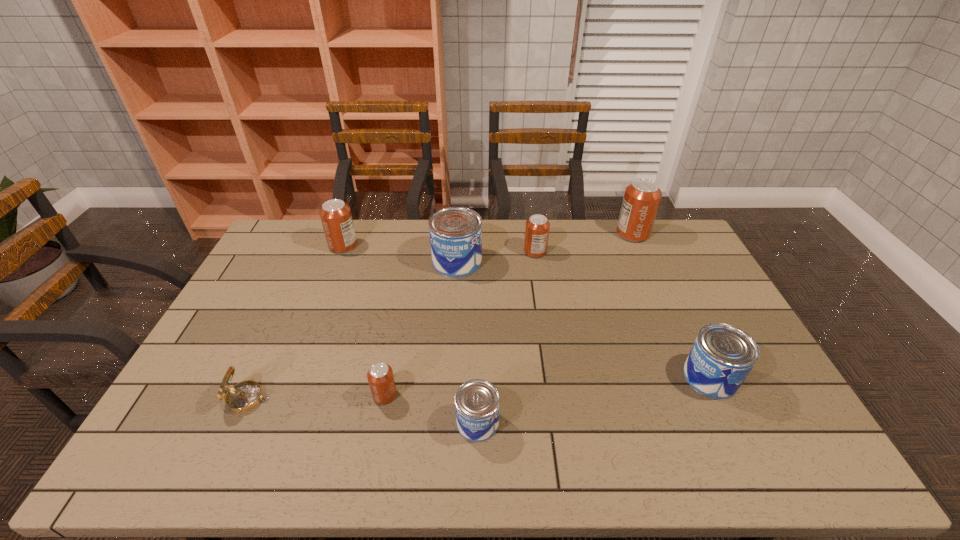
At what (x,y) coordinates should I click in order to perform the action: click on the second can from left to right. Please return your answer as a coordinate pair (x, y). Looking at the image, I should click on (380, 376).

The height and width of the screenshot is (540, 960). I want to click on the smallest orange can, so click(380, 376).

You are a GUI agent. You are given a task and a screenshot of the screen. Output one action in this format:
    pyautogui.click(x=<x>, y=<y>)
    Task: Click on the nearest blue can
    The width and height of the screenshot is (960, 540).
    Given the screenshot: What is the action you would take?
    pyautogui.click(x=477, y=402)

Find the location of a particular element. This screenshot has height=540, width=960. vacant space located 0.070m on the left of the rightmost orange can is located at coordinates tap(598, 234).

Where is `vacant space situated on the front of the leftmost orange can`? vacant space situated on the front of the leftmost orange can is located at coordinates tap(332, 274).

Locate an element on the screen. This screenshot has width=960, height=540. free spot located on the front label of the biggest blue can is located at coordinates (529, 262).

Find the location of a particular element. The height and width of the screenshot is (540, 960). free space located on the left of the third can from right to left is located at coordinates (499, 252).

Image resolution: width=960 pixels, height=540 pixels. In order to click on vacant area located on the front label of the rightmost blue can in this screenshot , I will do `click(586, 377)`.

Identify the location of vacant space situated 0.220m on the front label of the rightmost blue can. (604, 377).

This screenshot has width=960, height=540. I want to click on vacant area located 0.110m on the front label of the rightmost blue can, so click(x=644, y=377).